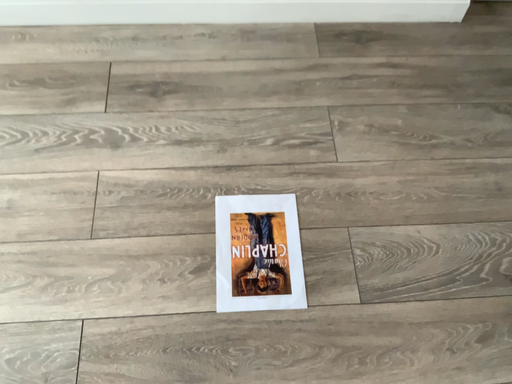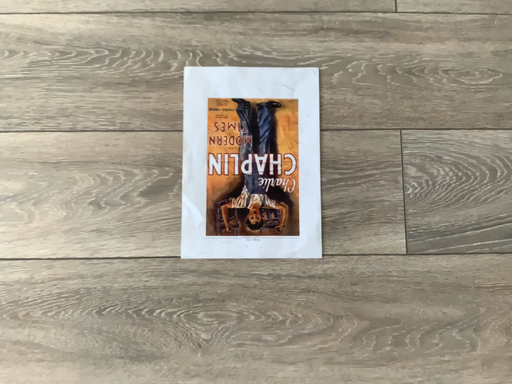
Question: How did the camera likely rotate when shooting the video?

Choices:
 (A) rotated downward
 (B) rotated upward

Answer: (A)